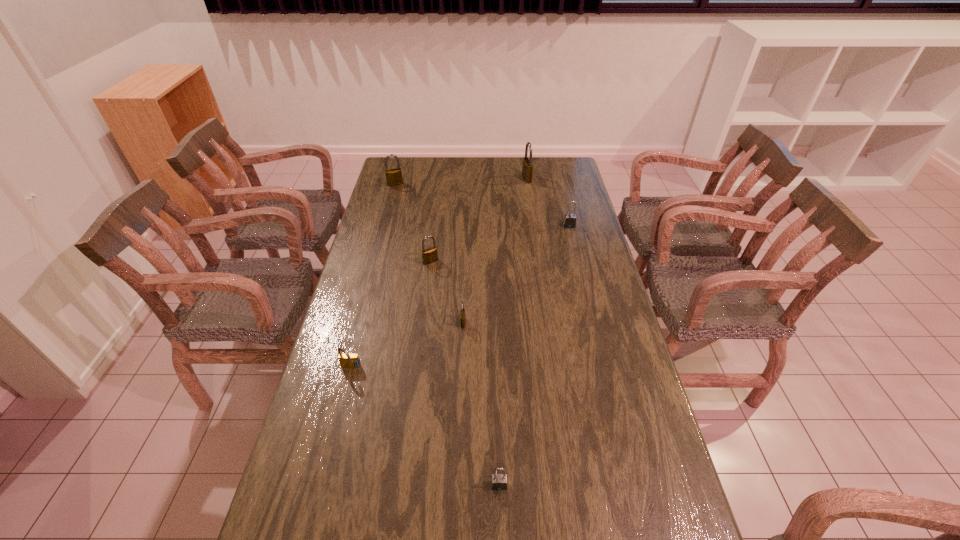
Image resolution: width=960 pixels, height=540 pixels. I want to click on the second object from right to left, so click(x=527, y=168).

You are a GUI agent. You are given a task and a screenshot of the screen. Output one action in this format:
    pyautogui.click(x=<x>, y=<y>)
    Task: Click on the tallest object
    Image resolution: width=960 pixels, height=540 pixels.
    Given the screenshot: What is the action you would take?
    pyautogui.click(x=527, y=168)

Locate an element on the screen. the leftmost brass padlock is located at coordinates (393, 176).

At what (x,y) coordinates should I click in order to perform the action: click on the sixth shortest object. Please return your answer as a coordinate pair (x, y). The height and width of the screenshot is (540, 960). Looking at the image, I should click on (393, 176).

Find the location of a particular element. The image size is (960, 540). the rightmost object is located at coordinates (569, 221).

Where is `the right gray padlock`? The image size is (960, 540). the right gray padlock is located at coordinates (569, 221).

Locate an element on the screen. This screenshot has height=540, width=960. the third brass padlock from right to left is located at coordinates (430, 255).

Where is `the fifth padlock from right to left`? The image size is (960, 540). the fifth padlock from right to left is located at coordinates (430, 255).

At what (x,y) coordinates should I click in order to perform the action: click on the sixth farthest object. Please return your answer as a coordinate pair (x, y). The image size is (960, 540). Looking at the image, I should click on (347, 360).

Where is `the left gray padlock`? The height and width of the screenshot is (540, 960). the left gray padlock is located at coordinates (498, 481).